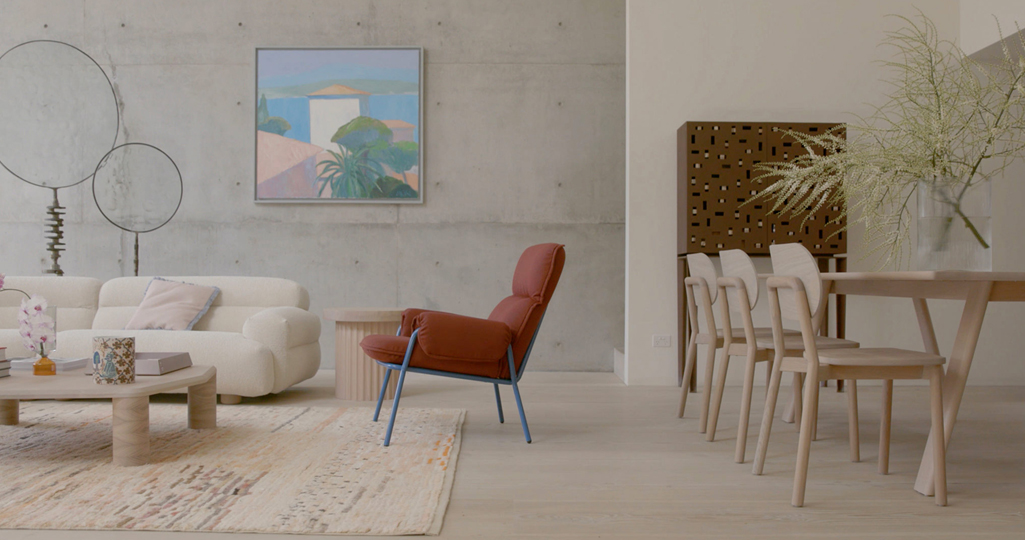
Identify the location of taller table legs. This screenshot has width=1025, height=540. (972, 327), (820, 303), (927, 318).